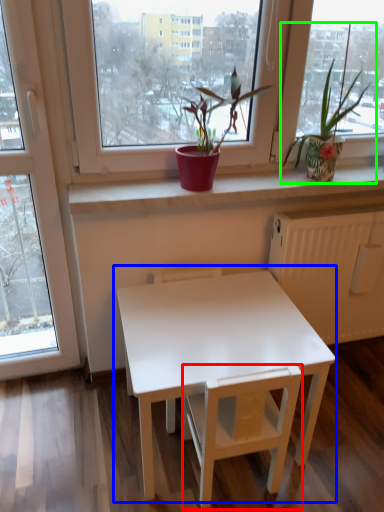
Question: Which object is positioned closest to armchair (highlighted by a red box)? Select from table (highlighted by a blue box) and houseplant (highlighted by a green box).

Choices:
 (A) table
 (B) houseplant

Answer: (A)